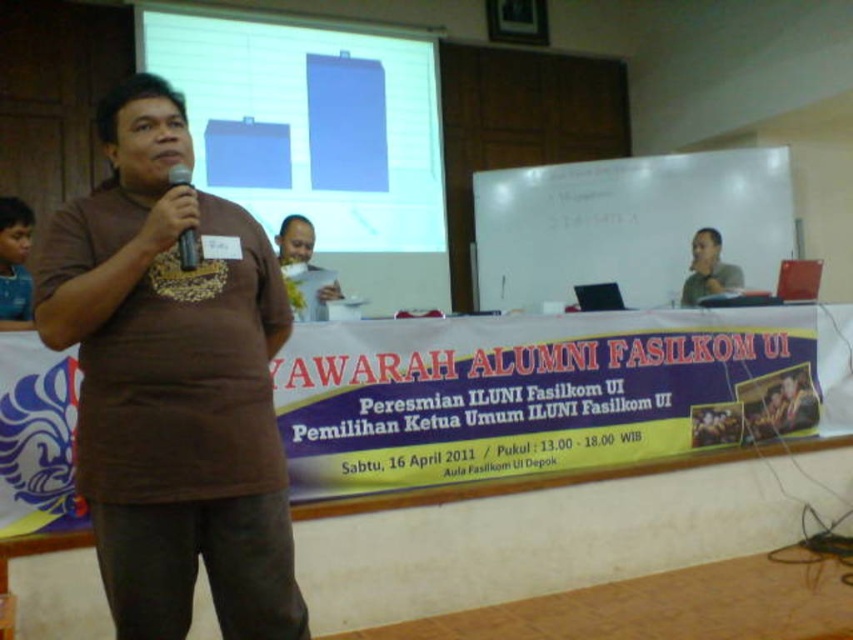
Who is shorter, brown cotton shirt at center or gray fabric shirt at upper center?

gray fabric shirt at upper center

Can you confirm if brown cotton shirt at center is thinner than gray fabric shirt at upper center?

No, brown cotton shirt at center is not thinner than gray fabric shirt at upper center.

Is point (160, 589) farther from camera compared to point (704, 256)?

No, it is in front of (704, 256).

The width and height of the screenshot is (853, 640). Find the location of `brown cotton shirt at center`. brown cotton shirt at center is located at coordinates (172, 385).

The height and width of the screenshot is (640, 853). I want to click on brown matte paper at center, so click(x=305, y=268).

Is brown matte paper at center positioned in front of gray fabric shirt at upper center?

Yes.

Identify the location of brown matte paper at center. Image resolution: width=853 pixels, height=640 pixels. (305, 268).

I want to click on brown matte paper at center, so click(305, 268).

I want to click on brown cotton shirt at center, so click(x=172, y=385).

Does brown cotton shirt at center have a greater width compared to matte blue projector screen at upper center?

In fact, brown cotton shirt at center might be narrower than matte blue projector screen at upper center.

Measure the distance between point [125,323] and camera.

They are 1.58 meters apart.

Where is `brown cotton shirt at center`? This screenshot has height=640, width=853. brown cotton shirt at center is located at coordinates (172, 385).